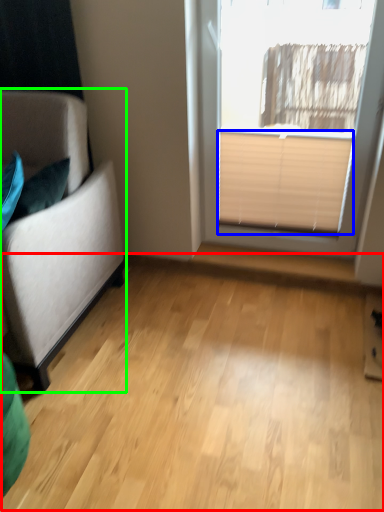
Question: Considering the real-world distances, which object is closest to plain (highlighted by a red box)? blind (highlighted by a blue box) or studio couch (highlighted by a green box).

Choices:
 (A) blind
 (B) studio couch

Answer: (B)